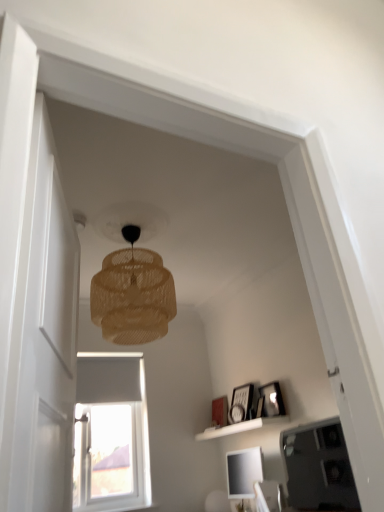
Image resolution: width=384 pixels, height=512 pixels. Identify the location of white matte shelf at lower center. (x=242, y=426).

Where is `matte black picture frame at upper right, which is the second picture frame from back to front`? The height and width of the screenshot is (512, 384). matte black picture frame at upper right, which is the second picture frame from back to front is located at coordinates (241, 403).

The image size is (384, 512). What do you see at coordinates (272, 400) in the screenshot?
I see `wooden picture frame at upper right, acting as the 3th picture frame starting from the left` at bounding box center [272, 400].

This screenshot has height=512, width=384. I want to click on transparent glass door at left, so click(42, 341).

I want to click on translucent woven lampshade at upper center, so click(133, 294).

From the picture: Who is more distant, wooden picture frame at upper right, placed as the 3th picture frame when sorted from back to front, or transparent glass door at left?

wooden picture frame at upper right, placed as the 3th picture frame when sorted from back to front, is further from the camera.

Does wooden picture frame at upper right, acting as the 3th picture frame starting from the left, have a larger size compared to transparent glass door at left?

Actually, wooden picture frame at upper right, acting as the 3th picture frame starting from the left, might be smaller than transparent glass door at left.

In the scene shown: Is wooden picture frame at upper right, acting as the 3th picture frame starting from the left, turned away from transparent glass door at left?

No, wooden picture frame at upper right, acting as the 3th picture frame starting from the left, is not facing away from transparent glass door at left.

What's the angular difference between wooden picture frame at upper right, acting as the 3th picture frame starting from the left, and transparent glass door at left's facing directions?

The angle between the facing direction of wooden picture frame at upper right, acting as the 3th picture frame starting from the left, and the facing direction of transparent glass door at left is 163 degrees.

Where is `glass door on the left of matte black picture frame at upper right, arranged as the 2th picture frame when viewed from the left`? glass door on the left of matte black picture frame at upper right, arranged as the 2th picture frame when viewed from the left is located at coordinates pyautogui.click(x=42, y=341).

Is matte black picture frame at upper right, which is the second picture frame from back to front, wider or thinner than transparent glass door at left?

matte black picture frame at upper right, which is the second picture frame from back to front, is wider than transparent glass door at left.

Does matte black picture frame at upper right, which is the second picture frame from back to front, lie in front of transparent glass door at left?

No, matte black picture frame at upper right, which is the second picture frame from back to front, is further to the viewer.

From the image's perspective, would you say matte black picture frame at upper right, acting as the second picture frame starting from the front, is shown under transparent glass door at left?

Indeed, from the image's perspective, matte black picture frame at upper right, acting as the second picture frame starting from the front, is shown beneath transparent glass door at left.

Which is behind, point (227, 404) or point (5, 433)?

The point (227, 404) is more distant.

Considering the sizes of matte white picture frame at center, placed as the 3th picture frame when sorted from right to left, and transparent glass door at left in the image, is matte white picture frame at center, placed as the 3th picture frame when sorted from right to left, taller or shorter than transparent glass door at left?

matte white picture frame at center, placed as the 3th picture frame when sorted from right to left, is shorter than transparent glass door at left.

From the image's perspective, which is above, matte white picture frame at center, which is counted as the first picture frame, starting from the left, or transparent glass door at left?

transparent glass door at left appears higher in the image.

Is matte white picture frame at center, the first picture frame from the back, smaller than transparent glass door at left?

Correct, matte white picture frame at center, the first picture frame from the back, occupies less space than transparent glass door at left.

Which object is further away from the camera taking this photo, translucent woven lampshade at upper center or wooden picture frame at upper right, placed as the first picture frame when sorted from front to back?

wooden picture frame at upper right, placed as the first picture frame when sorted from front to back, is further from the camera.

From the picture: Which of these two, translucent woven lampshade at upper center or wooden picture frame at upper right, placed as the first picture frame when sorted from front to back, stands taller?

translucent woven lampshade at upper center.

Is translucent woven lampshade at upper center to the right of wooden picture frame at upper right, acting as the 3th picture frame starting from the left, from the viewer's perspective?

Incorrect, translucent woven lampshade at upper center is not on the right side of wooden picture frame at upper right, acting as the 3th picture frame starting from the left.

Find the location of a particular element. The image size is (384, 512). the 1st picture frame below the translucent woven lampshade at upper center (from the image's perspective) is located at coordinates (272, 400).

Which is in front, point (274, 390) or point (145, 286)?

Positioned in front is point (145, 286).

From the image's perspective, between wooden picture frame at upper right, placed as the first picture frame when sorted from front to back, and translucent woven lampshade at upper center, which one is located above?

From the image's view, translucent woven lampshade at upper center is above.

Identify the location of lamp in front of the wooden picture frame at upper right, acting as the 3th picture frame starting from the left. (133, 294).

Does wooden picture frame at upper right, placed as the first picture frame when sorted from front to back, touch translucent woven lampshade at upper center?

No, wooden picture frame at upper right, placed as the first picture frame when sorted from front to back, is not touching translucent woven lampshade at upper center.

Considering the relative positions of wooden picture frame at upper right, placed as the first picture frame when sorted from front to back, and matte white picture frame at center, which is counted as the first picture frame, starting from the left, in the image provided, is wooden picture frame at upper right, placed as the first picture frame when sorted from front to back, to the left or to the right of matte white picture frame at center, which is counted as the first picture frame, starting from the left,?

Clearly, wooden picture frame at upper right, placed as the first picture frame when sorted from front to back, is on the right of matte white picture frame at center, which is counted as the first picture frame, starting from the left, in the image.

Is matte white picture frame at center, the third picture frame positioned from the front, at the back of wooden picture frame at upper right, placed as the first picture frame when sorted from front to back?

wooden picture frame at upper right, placed as the first picture frame when sorted from front to back, is not turned away from matte white picture frame at center, the third picture frame positioned from the front.

Would you say wooden picture frame at upper right, placed as the 3th picture frame when sorted from back to front, is outside matte white picture frame at center, the first picture frame from the back?

wooden picture frame at upper right, placed as the 3th picture frame when sorted from back to front, lies outside matte white picture frame at center, the first picture frame from the back,'s area.

From a real-world perspective, is wooden picture frame at upper right, positioned as the 1th picture frame in right-to-left order, located beneath matte white picture frame at center, the first picture frame from the back?

Yes, from a real-world perspective, wooden picture frame at upper right, positioned as the 1th picture frame in right-to-left order, is under matte white picture frame at center, the first picture frame from the back.

Is there a large distance between translucent woven lampshade at upper center and transparent glass door at left?

Yes, translucent woven lampshade at upper center and transparent glass door at left are quite far apart.

From the picture: Can you confirm if translucent woven lampshade at upper center is taller than transparent glass door at left?

In fact, translucent woven lampshade at upper center may be shorter than transparent glass door at left.

Does translucent woven lampshade at upper center turn towards transparent glass door at left?

No.

The height and width of the screenshot is (512, 384). In order to click on the 1st picture frame located above the transparent glass door at left (from a real-world perspective) in this screenshot , I will do `click(272, 400)`.

This screenshot has width=384, height=512. What are the coordinates of `glass door lying in front of the matte black picture frame at upper right, arranged as the 2th picture frame when viewed from the right` in the screenshot? It's located at (42, 341).

From the image, which object appears to be nearer to white matte shelf at lower center, matte black picture frame at upper right, acting as the second picture frame starting from the front, or wooden picture frame at upper right, acting as the 3th picture frame starting from the left?

Based on the image, matte black picture frame at upper right, acting as the second picture frame starting from the front, appears to be nearer to white matte shelf at lower center.

Considering their positions, is translucent woven lampshade at upper center positioned closer to matte black picture frame at upper right, arranged as the 2th picture frame when viewed from the left, than transparent glass door at left?

translucent woven lampshade at upper center is positioned closer to the anchor matte black picture frame at upper right, arranged as the 2th picture frame when viewed from the left.

Based on their spatial positions, is matte black picture frame at upper right, arranged as the 2th picture frame when viewed from the left, or translucent woven lampshade at upper center closer to matte white picture frame at center, the third picture frame positioned from the front?

matte black picture frame at upper right, arranged as the 2th picture frame when viewed from the left, is closer to matte white picture frame at center, the third picture frame positioned from the front.

From the picture: When comparing their distances from matte black picture frame at upper right, which is the second picture frame from back to front, does matte white picture frame at center, placed as the 3th picture frame when sorted from right to left, or white matte shelf at lower center seem further?

matte white picture frame at center, placed as the 3th picture frame when sorted from right to left.

Considering their positions, is wooden picture frame at upper right, placed as the 3th picture frame when sorted from back to front, positioned closer to matte white picture frame at center, which is counted as the first picture frame, starting from the left, than translucent woven lampshade at upper center?

Among the two, wooden picture frame at upper right, placed as the 3th picture frame when sorted from back to front, is located nearer to matte white picture frame at center, which is counted as the first picture frame, starting from the left.

When comparing their distances from transparent glass door at left, does white matte shelf at lower center or translucent woven lampshade at upper center seem closer?

translucent woven lampshade at upper center is positioned closer to the anchor transparent glass door at left.

Based on their spatial positions, is wooden picture frame at upper right, placed as the first picture frame when sorted from front to back, or matte white picture frame at center, placed as the 3th picture frame when sorted from right to left, further from matte black picture frame at upper right, arranged as the 2th picture frame when viewed from the left?

The object further to matte black picture frame at upper right, arranged as the 2th picture frame when viewed from the left, is matte white picture frame at center, placed as the 3th picture frame when sorted from right to left.

Considering their positions, is transparent glass door at left positioned closer to matte white picture frame at center, placed as the 3th picture frame when sorted from right to left, than translucent woven lampshade at upper center?

The object closer to matte white picture frame at center, placed as the 3th picture frame when sorted from right to left, is translucent woven lampshade at upper center.

Identify the location of lamp between transparent glass door at left and white matte shelf at lower center along the z-axis. The image size is (384, 512). (133, 294).

The height and width of the screenshot is (512, 384). Identify the location of lamp between transparent glass door at left and wooden picture frame at upper right, acting as the 3th picture frame starting from the left, along the z-axis. (133, 294).

I want to click on picture frame between transparent glass door at left and matte black picture frame at upper right, arranged as the 2th picture frame when viewed from the right, in the front-back direction, so click(x=272, y=400).

Where is `picture frame positioned between translucent woven lampshade at upper center and matte black picture frame at upper right, acting as the second picture frame starting from the front, from near to far`? This screenshot has width=384, height=512. picture frame positioned between translucent woven lampshade at upper center and matte black picture frame at upper right, acting as the second picture frame starting from the front, from near to far is located at coordinates (272, 400).